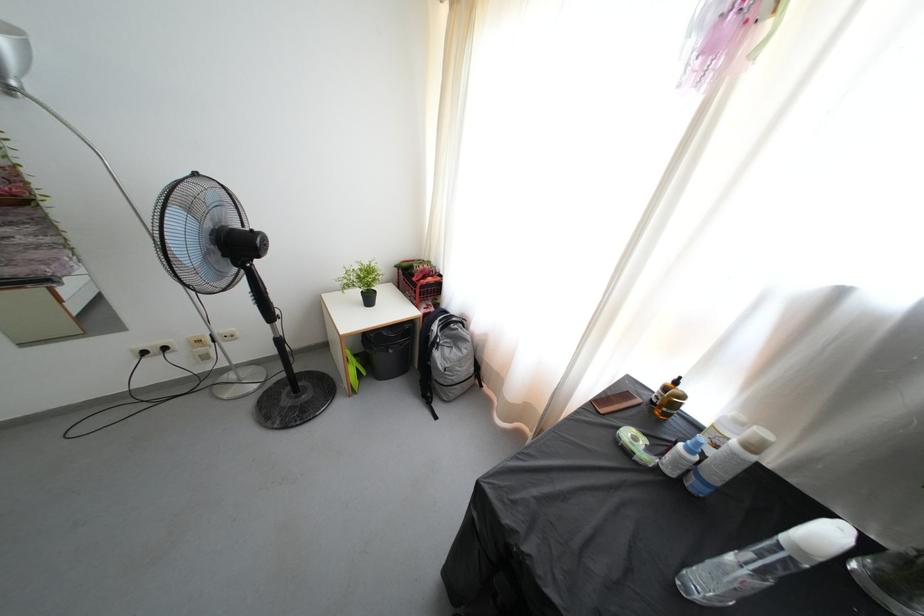
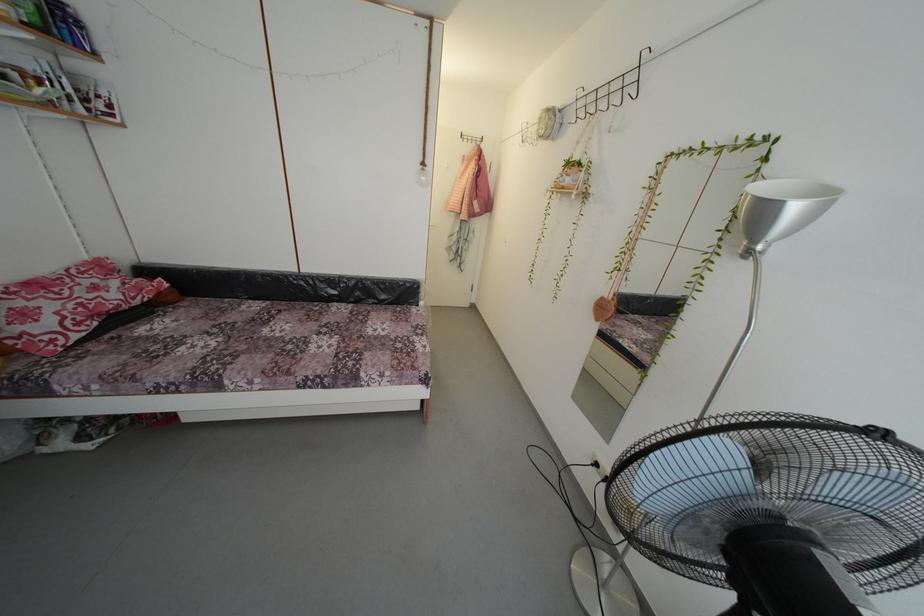
In the second image, find the point that corresponds to the point at 220,254 in the first image.

(723, 537)